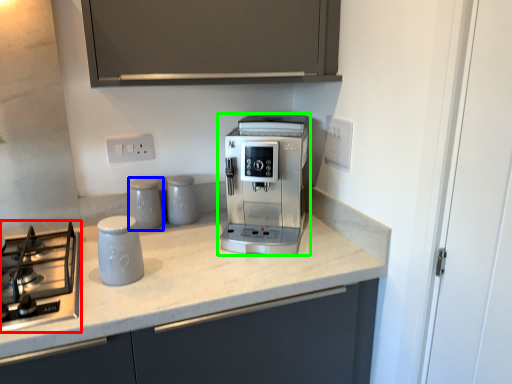
Question: Which is nearer to the home appliance (highlighted by a red box)? kitchen appliance (highlighted by a blue box) or coffee maker (highlighted by a green box).

Choices:
 (A) kitchen appliance
 (B) coffee maker

Answer: (A)